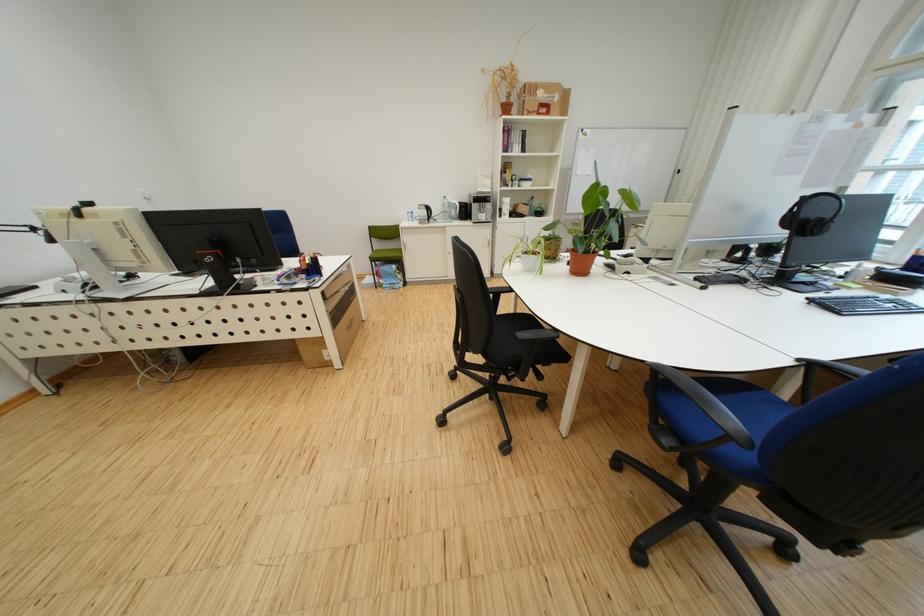
Find the location of a particular element. green chair sitting surface is located at coordinates (385, 254).